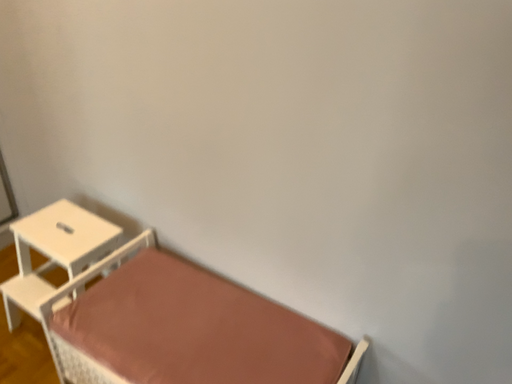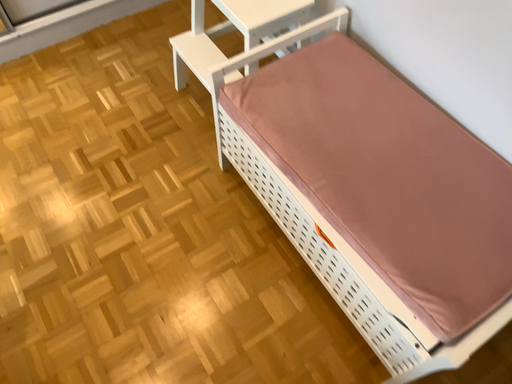
Question: How did the camera likely rotate when shooting the video?

Choices:
 (A) rotated downward
 (B) rotated upward

Answer: (A)